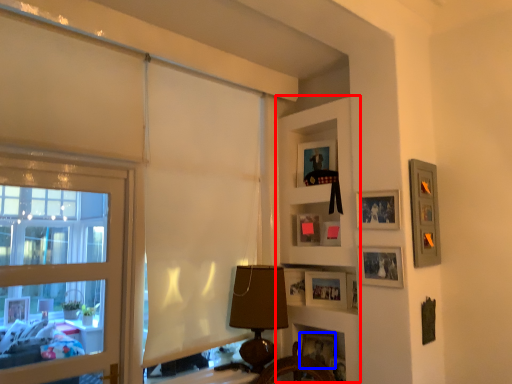
Question: Which of the following is the closest to the observer, shelf (highlighted by a red box) or picture frame (highlighted by a blue box)?

Choices:
 (A) shelf
 (B) picture frame

Answer: (A)